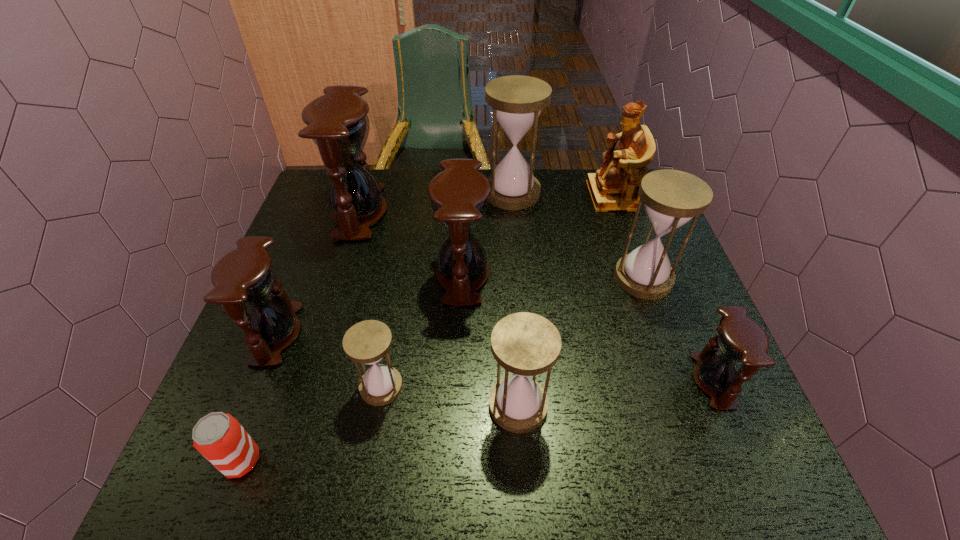
This screenshot has height=540, width=960. Find the location of `object that is at the near left corner`. object that is at the near left corner is located at coordinates (220, 438).

Where is `object that is at the far right corner`? The height and width of the screenshot is (540, 960). object that is at the far right corner is located at coordinates click(613, 188).

You are a GUI agent. You are given a task and a screenshot of the screen. Output one action in this format:
    pyautogui.click(x=<x>, y=<y>)
    Task: Click on the free space at the far edge
    The width and height of the screenshot is (960, 540).
    Given the screenshot: What is the action you would take?
    coord(545,178)

This screenshot has width=960, height=540. In order to click on vacant space at the near edge of the desktop in this screenshot , I will do `click(474, 464)`.

This screenshot has width=960, height=540. I want to click on free point at the left edge, so click(x=294, y=288).

This screenshot has height=540, width=960. I want to click on blank space at the right edge, so click(x=673, y=305).

Locate an element on the screen. free space that is in between the biggest white hourglass and the third smallest brown hourglass is located at coordinates pos(488,234).

Locate an element on the screen. This screenshot has width=960, height=540. empty space between the third biggest white hourglass and the second farthest white hourglass is located at coordinates (581, 342).

Where is `free space between the second biggest brown hourglass and the figurine`? This screenshot has height=540, width=960. free space between the second biggest brown hourglass and the figurine is located at coordinates (537, 235).

I want to click on vacant space that is in between the seventh object from right to left and the second smallest white hourglass, so click(x=449, y=396).